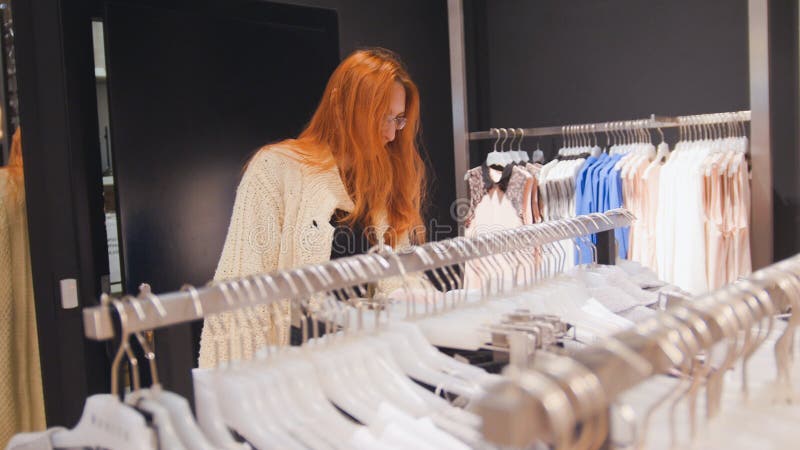
In order to click on white wall sensor in this screenshot , I will do `click(70, 286)`.